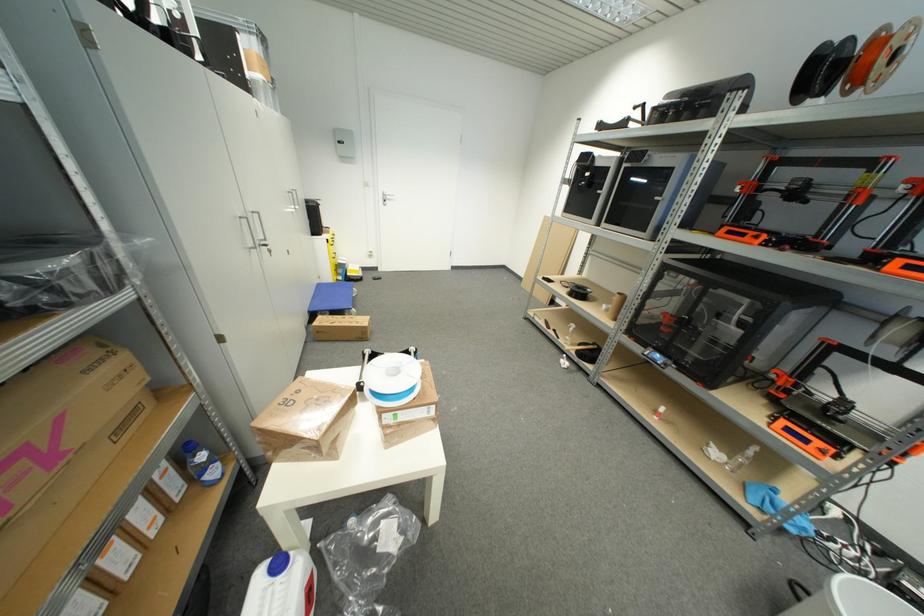
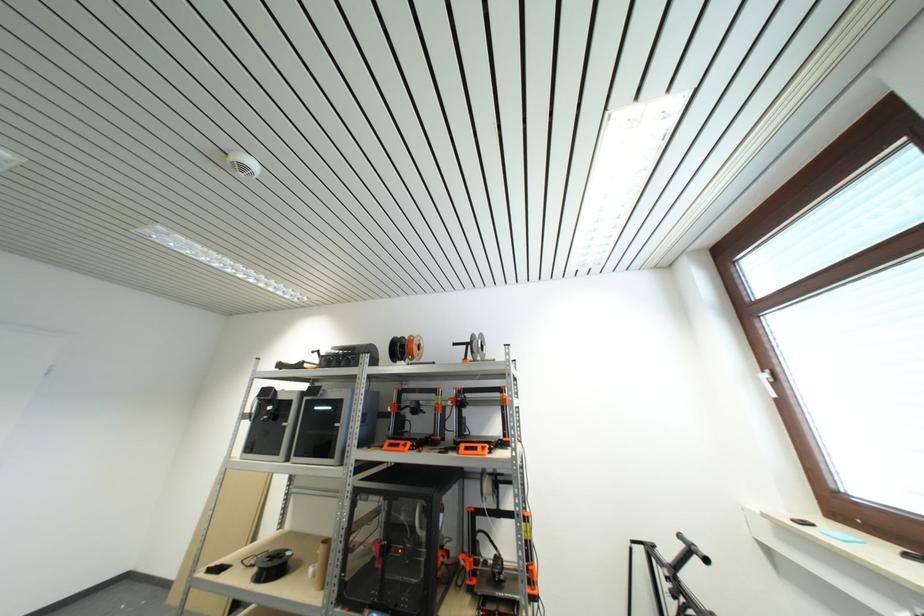
Where in the second image is the point corresponding to (x=594, y=221) from the first image?

(283, 456)